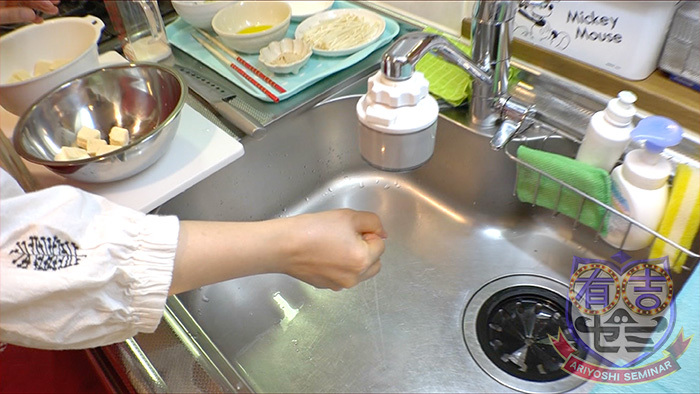
At what (x,y) coordinates should I click in order to perform the action: click on white bowl. Please return your answer as a coordinate pair (x, y). Image resolution: width=700 pixels, height=394 pixels. Looking at the image, I should click on (239, 36).